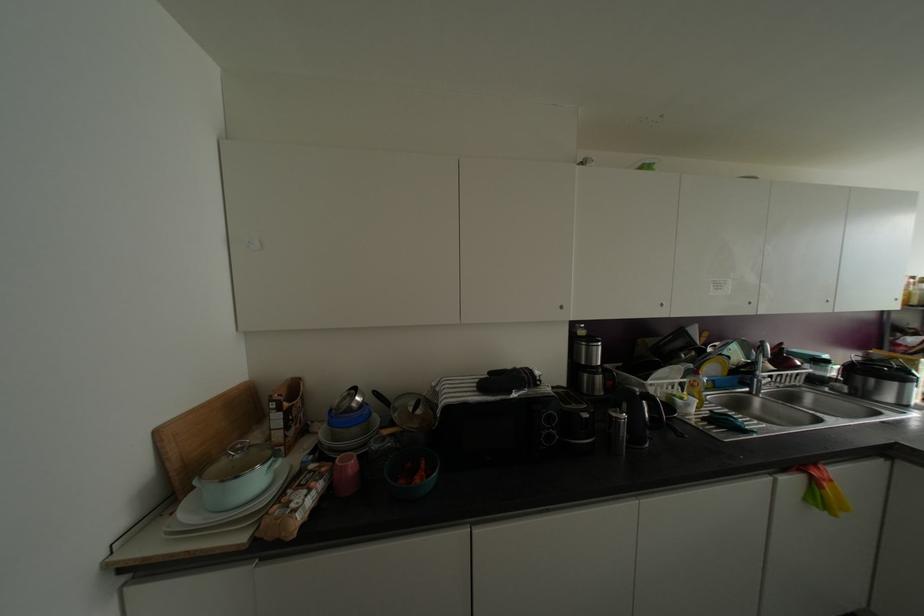
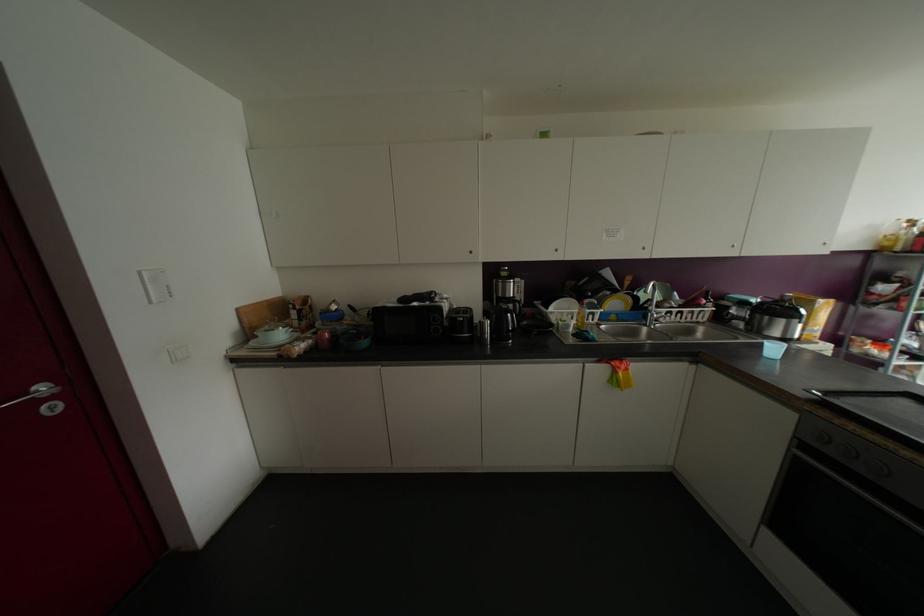
In the second image, find the point that corresponds to [661,304] in the first image.

(555, 249)